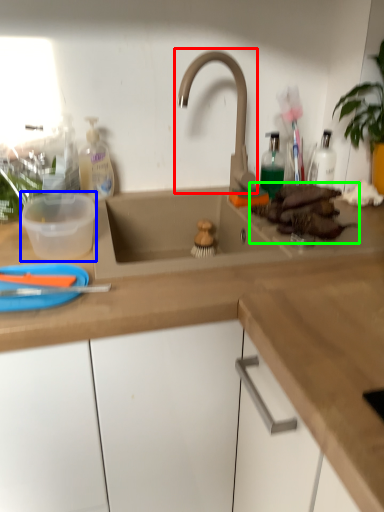
Question: Based on their relative distances, which object is nearer to tap (highlighted by a red box)? Choose from basin (highlighted by a blue box) and food (highlighted by a green box).

Choices:
 (A) basin
 (B) food

Answer: (B)